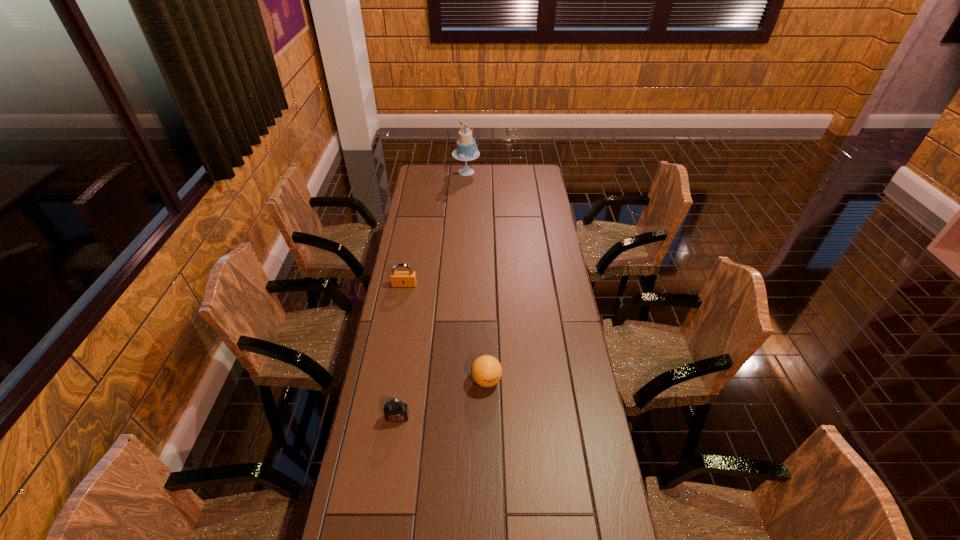
I want to click on the farthest object, so click(466, 150).

Where is `cake`? cake is located at coordinates (466, 150).

At what (x,y) coordinates should I click in order to perform the action: click on the third nearest object. Please return your answer as a coordinate pair (x, y). Looking at the image, I should click on (398, 278).

The height and width of the screenshot is (540, 960). What are the coordinates of `the second nearest object` in the screenshot? It's located at (486, 371).

This screenshot has height=540, width=960. Identify the location of the nearer padlock. (395, 410).

I want to click on vacant space located 0.310m with a ladder on the side of the tallest object, so click(x=534, y=172).

Image resolution: width=960 pixels, height=540 pixels. In order to click on free space located 0.120m to unlock the farther padlock from the front in this screenshot , I will do `click(400, 309)`.

I want to click on vacant space situated on the side with brand of the ping-pong ball, so click(488, 501).

In order to click on vacant area situated 0.280m on the front of the nearer padlock near the keyhole in this screenshot , I will do `click(382, 518)`.

Where is `object positioned at the far edge`? Image resolution: width=960 pixels, height=540 pixels. object positioned at the far edge is located at coordinates click(x=466, y=150).